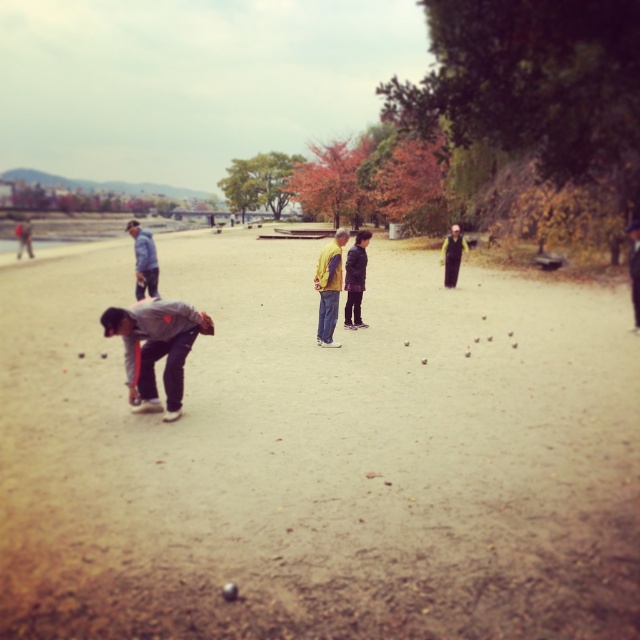
Who is lower down, brown sandy ground at center or yellow jacket at center?

Positioned lower is brown sandy ground at center.

Does point (536, 385) come behind point (330, 305)?

No, it is in front of (330, 305).

Where is `brown sandy ground at center`? The height and width of the screenshot is (640, 640). brown sandy ground at center is located at coordinates (321, 456).

Between point (355, 257) and point (448, 248), which one is positioned in front?

Point (355, 257)

Is dark gray hoodie at center to the right of black fabric jacket at center from the viewer's perspective?

In fact, dark gray hoodie at center is to the left of black fabric jacket at center.

Identify the location of dark gray hoodie at center. Image resolution: width=640 pixels, height=640 pixels. (355, 280).

You are a GUI agent. You are given a task and a screenshot of the screen. Output one action in this format:
    pyautogui.click(x=<x>, y=<y>)
    Task: Click on the dark gray hoodie at center
    The image size is (640, 640).
    Given the screenshot: What is the action you would take?
    pyautogui.click(x=355, y=280)

Which is in front, point (323, 307) or point (365, 257)?

Positioned in front is point (323, 307).

This screenshot has height=640, width=640. What do you see at coordinates (330, 285) in the screenshot?
I see `yellow jacket at center` at bounding box center [330, 285].

Which is in front, point (336, 300) or point (348, 285)?

Point (336, 300)

Locate an element on the screen. The height and width of the screenshot is (640, 640). yellow jacket at center is located at coordinates (330, 285).